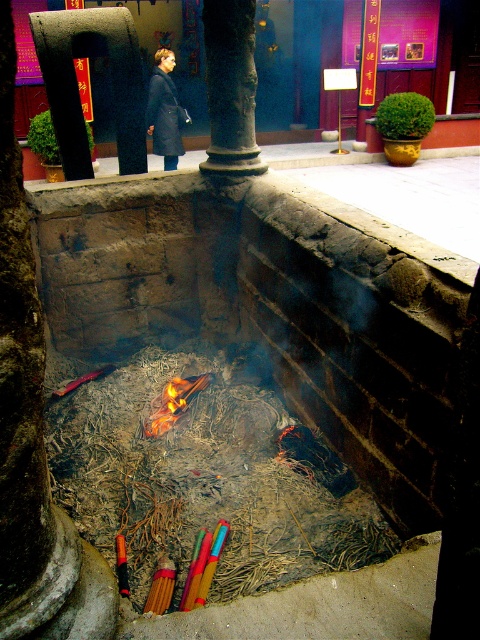
You are standing in front of the stone altar and want to place an offering. There are two points marked on the altar where offerings can be placed. Which point is closer to you, point (224, 168) or point (179, 400)?

Point (224, 168) is closer to you than point (179, 400) because it is further to the viewer.

You are standing in a temple and want to place a new incense stick on the dark blue coat at center. Can you directly place it there without moving the dark gray stone column at center?

The dark gray stone column at center is in front of the dark blue coat at center, so you cannot directly place the incense stick on the dark blue coat at center without moving the dark gray stone column at center first.

You are a visitor at the temple and want to light an incense stick. The dark gray stone column at center and the flametransparentfire at center are in your view. Which object should you approach to light the incense?

You should approach the flametransparentfire at center to light the incense because the dark gray stone column at center is positioned to the right of the fire, meaning the fire is the source of the flame needed for lighting the incense.